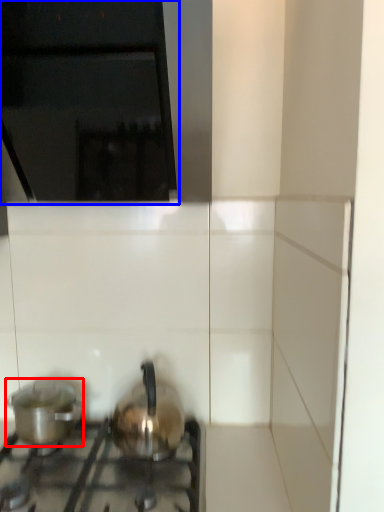
Question: Which object is further to the camera taking this photo, kitchen appliance (highlighted by a red box) or vent (highlighted by a blue box)?

Choices:
 (A) kitchen appliance
 (B) vent

Answer: (A)